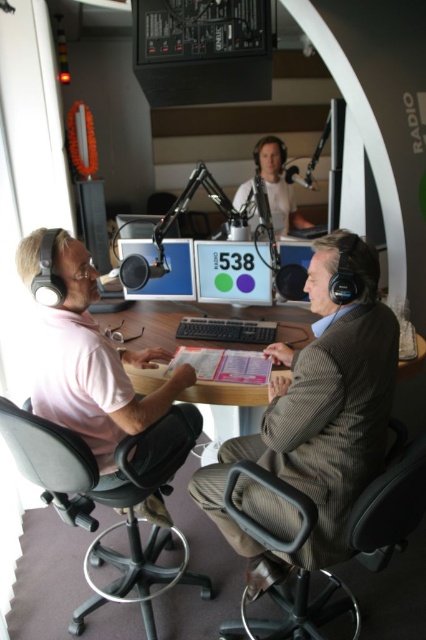
This screenshot has height=640, width=426. I want to click on matte pink shirt at left, so click(92, 365).

Which is more to the left, matte pink shirt at left or matte black monitor at center?

Positioned to the left is matte pink shirt at left.

The width and height of the screenshot is (426, 640). Describe the element at coordinates (92, 365) in the screenshot. I see `matte pink shirt at left` at that location.

The width and height of the screenshot is (426, 640). Find the location of `matte pink shirt at left`. matte pink shirt at left is located at coordinates (92, 365).

Does black leather swivel chair at lower center appear on the right side of light brown wood microphone at upper center?

Yes, black leather swivel chair at lower center is to the right of light brown wood microphone at upper center.

Image resolution: width=426 pixels, height=640 pixels. Describe the element at coordinates (389, 502) in the screenshot. I see `black leather swivel chair at lower center` at that location.

Image resolution: width=426 pixels, height=640 pixels. I want to click on black leather swivel chair at lower center, so click(x=389, y=502).

Who is taller, black leather swivel chair at center or black leather swivel chair at lower center?

black leather swivel chair at center

Which is behind, point (164, 572) or point (293, 625)?

Point (164, 572)

Who is more forward, (74, 504) or (411, 456)?

Point (411, 456) is more forward.

Locate an element on the screen. The width and height of the screenshot is (426, 640). black leather swivel chair at center is located at coordinates (80, 465).